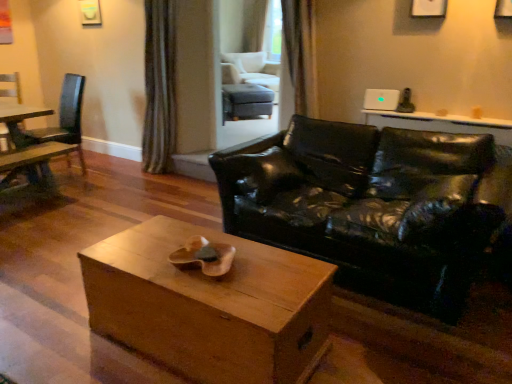
This screenshot has width=512, height=384. I want to click on wooden chair at left, which is the second chair in right-to-left order, so click(x=65, y=118).

Identify the location of wooden bench at left. (31, 169).

Measure the distance between satin curtain at upper center, acting as the second curtain starting from the left, and camera.

They are 3.32 meters apart.

Describe the element at coordinates (369, 206) in the screenshot. This screenshot has width=512, height=384. I see `black leather couch at center` at that location.

Where is `wooden box at center`? wooden box at center is located at coordinates (210, 305).

This screenshot has height=384, width=512. I want to click on wooden chair at left, which is the first chair in left-to-right order, so click(x=10, y=88).

Where is `matte gray ottoman at center, marked as the 3th chair in a front-to-back arrangement`? This screenshot has width=512, height=384. matte gray ottoman at center, marked as the 3th chair in a front-to-back arrangement is located at coordinates (243, 97).

From a real-world perspective, is wooden bench at left positioned over matte gray ottoman at center, which is the first chair in back-to-front order, based on gravity?

No, from a real-world perspective, wooden bench at left is not over matte gray ottoman at center, which is the first chair in back-to-front order

Which of these two, wooden bench at left or matte gray ottoman at center, marked as the 3th chair in a front-to-back arrangement, stands taller?

With more height is matte gray ottoman at center, marked as the 3th chair in a front-to-back arrangement.

Is wooden bench at left far away from matte gray ottoman at center, which is the first chair in back-to-front order?

Indeed, wooden bench at left is not near matte gray ottoman at center, which is the first chair in back-to-front order.

From the image's perspective, is wooden bench at left above or below matte gray ottoman at center, the 3th chair from the left?

From the image's perspective, wooden bench at left appears below matte gray ottoman at center, the 3th chair from the left.

Locate an element on the screen. the 2nd curtain above the wooden chair at left, which is the first chair from front to back (from the image's perspective) is located at coordinates (159, 87).

Is green textured curtain at upper center, positioned as the 2th curtain in right-to-left order, directly adjacent to wooden chair at left, which is the second chair in right-to-left order?

No, green textured curtain at upper center, positioned as the 2th curtain in right-to-left order, is not next to wooden chair at left, which is the second chair in right-to-left order.

Does point (163, 172) come closer to viewer compared to point (81, 161)?

Yes, point (163, 172) is closer to viewer.

Is green textured curtain at upper center, which is the first curtain in left-to-right order, completely or partially outside of wooden chair at left, the second chair viewed from the left?

Yes.

Does matte gray ottoman at center, marked as the first chair in a right-to-left arrangement, have a smaller size compared to green textured curtain at upper center, arranged as the first curtain when viewed from the back?

No, matte gray ottoman at center, marked as the first chair in a right-to-left arrangement, is not smaller than green textured curtain at upper center, arranged as the first curtain when viewed from the back.

From the image's perspective, between matte gray ottoman at center, marked as the 3th chair in a front-to-back arrangement, and green textured curtain at upper center, positioned as the 2th curtain in right-to-left order, which one is located above?

matte gray ottoman at center, marked as the 3th chair in a front-to-back arrangement, appears higher in the image.

In terms of width, does matte gray ottoman at center, marked as the first chair in a right-to-left arrangement, look wider or thinner when compared to green textured curtain at upper center, arranged as the first curtain when viewed from the back?

Clearly, matte gray ottoman at center, marked as the first chair in a right-to-left arrangement, has more width compared to green textured curtain at upper center, arranged as the first curtain when viewed from the back.

Is wooden chair at left, which is the first chair from front to back, looking in the opposite direction of wooden bench at left?

No.

How many degrees apart are the facing directions of wooden chair at left, the second chair viewed from the left, and wooden bench at left?

The angle between the facing direction of wooden chair at left, the second chair viewed from the left, and the facing direction of wooden bench at left is 86.4 degrees.

Is wooden chair at left, acting as the third chair starting from the back, far from wooden bench at left?

No, wooden chair at left, acting as the third chair starting from the back, is in close proximity to wooden bench at left.

Considering the sizes of objects wooden chair at left, acting as the third chair starting from the back, and wooden bench at left in the image provided, who is smaller, wooden chair at left, acting as the third chair starting from the back, or wooden bench at left?

With smaller size is wooden bench at left.

From a real-world perspective, is wooden chair at left, which is counted as the second chair, starting from the front, physically below wooden box at center?

No.

Is wooden chair at left, which is counted as the second chair, starting from the front, at the right side of wooden box at center?

Incorrect, wooden chair at left, which is counted as the second chair, starting from the front, is not on the right side of wooden box at center.

Is wooden chair at left, positioned as the 2th chair in back-to-front order, outside of wooden box at center?

Yes.

Considering the sizes of wooden chair at left, positioned as the 2th chair in back-to-front order, and wooden box at center in the image, is wooden chair at left, positioned as the 2th chair in back-to-front order, bigger or smaller than wooden box at center?

Clearly, wooden chair at left, positioned as the 2th chair in back-to-front order, is smaller in size than wooden box at center.

Is black leather couch at center with wooden chair at left, which is counted as the second chair, starting from the front?

No, black leather couch at center is not next to wooden chair at left, which is counted as the second chair, starting from the front.

Is the position of black leather couch at center more distant than that of wooden chair at left, which is the first chair in left-to-right order?

No.

Considering the relative positions of black leather couch at center and wooden chair at left, the 3th chair in the right-to-left sequence, in the image provided, is black leather couch at center to the left or to the right of wooden chair at left, the 3th chair in the right-to-left sequence,?

Based on their positions, black leather couch at center is located to the right of wooden chair at left, the 3th chair in the right-to-left sequence.

Is wooden chair at left, positioned as the 2th chair in back-to-front order, placed right next to black leather couch at center?

No, wooden chair at left, positioned as the 2th chair in back-to-front order, is not touching black leather couch at center.

Is the depth of wooden chair at left, the 3th chair in the right-to-left sequence, less than that of black leather couch at center?

No.

From the image's perspective, which is below, wooden chair at left, positioned as the 2th chair in back-to-front order, or black leather couch at center?

black leather couch at center appears lower in the image.

Where is `studio couch lying below the wooden chair at left, which is the first chair in left-to-right order (from the image's perspective)`? The image size is (512, 384). studio couch lying below the wooden chair at left, which is the first chair in left-to-right order (from the image's perspective) is located at coordinates (369, 206).

From the image's perspective, count 3rd chairs upward from the wooden bench at left and point to it. Please provide its 2D coordinates.

[(243, 97)]

From the image's perspective, which chair is the 2nd one below the green textured curtain at upper center, the 2th curtain in the front-to-back sequence? Please provide its 2D coordinates.

[(65, 118)]

Which object lies nearer to the anchor point wooden box at center, green textured curtain at upper center, the 2th curtain in the front-to-back sequence, or wooden chair at left, which is the first chair in left-to-right order?

The object closer to wooden box at center is green textured curtain at upper center, the 2th curtain in the front-to-back sequence.

Looking at the image, which one is located further to green textured curtain at upper center, arranged as the first curtain when viewed from the back, wooden chair at left, which is counted as the second chair, starting from the front, or wooden bench at left?

Based on the image, wooden chair at left, which is counted as the second chair, starting from the front, appears to be further to green textured curtain at upper center, arranged as the first curtain when viewed from the back.

From the image, which object appears to be farther from wooden bench at left, black leather couch at center or wooden chair at left, the second chair viewed from the left?

The object further to wooden bench at left is black leather couch at center.

Considering their positions, is wooden box at center positioned closer to green textured curtain at upper center, which is the first curtain in left-to-right order, than wooden chair at left, which is the first chair from front to back?

The object closer to green textured curtain at upper center, which is the first curtain in left-to-right order, is wooden chair at left, which is the first chair from front to back.

Considering their positions, is green textured curtain at upper center, arranged as the first curtain when viewed from the back, positioned closer to black leather couch at center than wooden box at center?

wooden box at center.

From the image, which object appears to be farther from wooden bench at left, matte gray ottoman at center, the 3th chair from the left, or wooden box at center?

wooden box at center is further to wooden bench at left.

From the image, which object appears to be nearer to wooden box at center, green textured curtain at upper center, the 2th curtain in the front-to-back sequence, or matte gray ottoman at center, the 3th chair from the left?

green textured curtain at upper center, the 2th curtain in the front-to-back sequence.

Which object lies nearer to the anchor point green textured curtain at upper center, which is the first curtain in left-to-right order, wooden box at center or black leather couch at center?

Based on the image, black leather couch at center appears to be nearer to green textured curtain at upper center, which is the first curtain in left-to-right order.

You are a GUI agent. You are given a task and a screenshot of the screen. Output one action in this format:
    pyautogui.click(x=<x>, y=<y>)
    Task: Click on the chair located between wooden box at center and green textured curtain at upper center, the 2th curtain in the front-to-back sequence, in the depth direction
    The width and height of the screenshot is (512, 384).
    Given the screenshot: What is the action you would take?
    pyautogui.click(x=65, y=118)

This screenshot has height=384, width=512. I want to click on curtain positioned between wooden chair at left, the second chair viewed from the left, and matte gray ottoman at center, marked as the 3th chair in a front-to-back arrangement, from near to far, so click(x=159, y=87).

The width and height of the screenshot is (512, 384). In order to click on curtain between wooden chair at left, which is the second chair in right-to-left order, and satin curtain at upper center, which is the second curtain in back-to-front order, from left to right in this screenshot , I will do `click(159, 87)`.

At what (x,y) coordinates should I click in order to perform the action: click on studio couch located between wooden box at center and satin curtain at upper center, which is the second curtain in back-to-front order, in the depth direction. Please return your answer as a coordinate pair (x, y). Looking at the image, I should click on (369, 206).